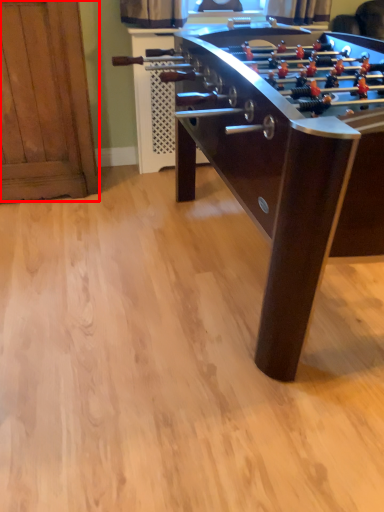
Question: From the image's perspective, where is furniture (annotated by the red box) located in relation to table in the image?

Choices:
 (A) below
 (B) above

Answer: (B)